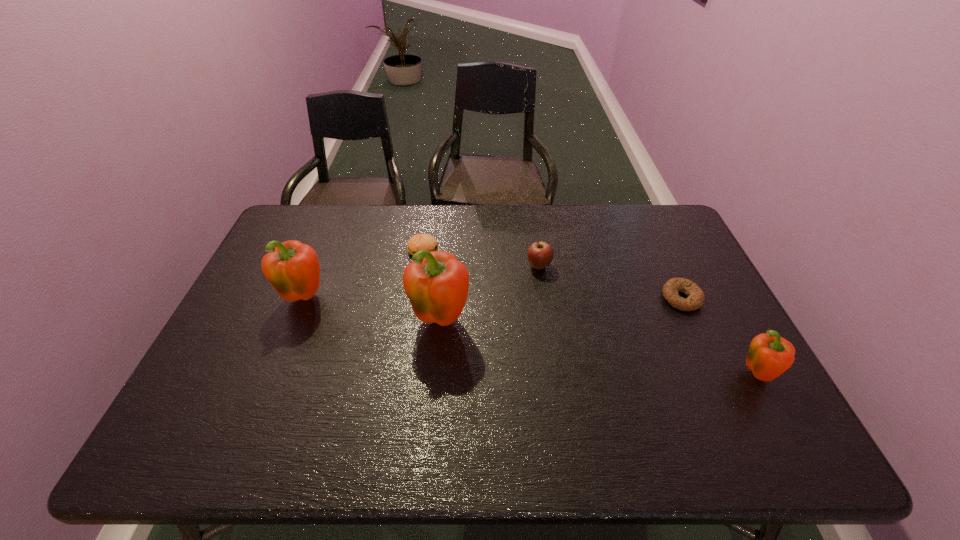
Find the location of a particular element. This screenshot has height=540, width=960. vacant space that satisfies the following two spatial constraints: 1. on the front side of the rightmost pepper; 2. on the left side of the fourth tallest object is located at coordinates (555, 376).

Locate an element on the screen. Image resolution: width=960 pixels, height=540 pixels. vacant area in the image that satisfies the following two spatial constraints: 1. on the front side of the shortest pepper; 2. on the left side of the bagel is located at coordinates [718, 376].

Find the location of a particular element. The height and width of the screenshot is (540, 960). vacant region that satisfies the following two spatial constraints: 1. on the front side of the nearest pepper; 2. on the left side of the second tallest pepper is located at coordinates (274, 376).